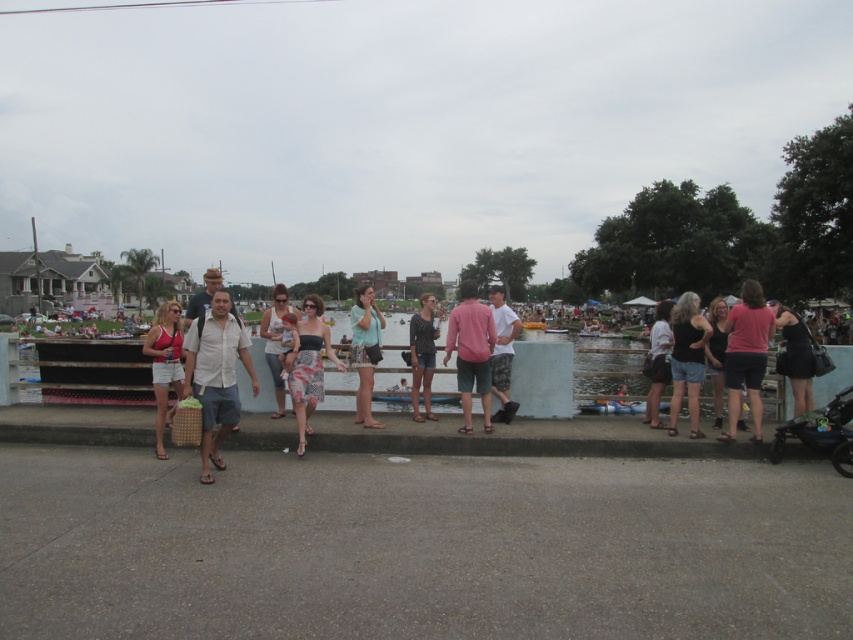
Question: Does pink cotton shirt at center have a lesser width compared to printed fabric dress at center?

Choices:
 (A) yes
 (B) no

Answer: (A)

Question: Based on their relative distances, which object is farther from the printed fabric dress at center?

Choices:
 (A) white cotton shirt at center
 (B) matte black shirt at center
 (C) camouflage shorts at center

Answer: (C)

Question: Can you confirm if pink cotton shirt at center is bigger than matte black tank top at right?

Choices:
 (A) no
 (B) yes

Answer: (B)

Question: Can you confirm if pink cotton shirt at center is wider than matte black shirt at center?

Choices:
 (A) no
 (B) yes

Answer: (B)

Question: Which point is closer to the camera taking this photo?

Choices:
 (A) (432, 349)
 (B) (260, 330)
 (C) (720, 356)

Answer: (C)

Question: Considering the real-world distances, which object is closest to the printed fabric dress at center?

Choices:
 (A) matte pink shirt at center
 (B) matte white tank top at center

Answer: (B)